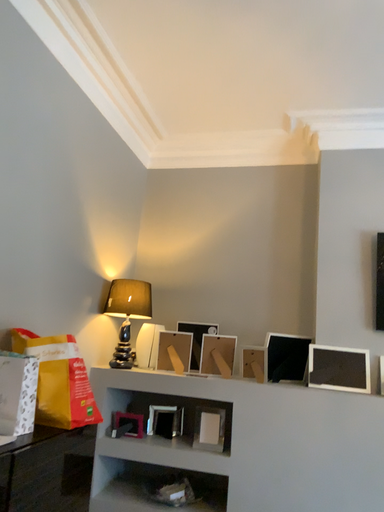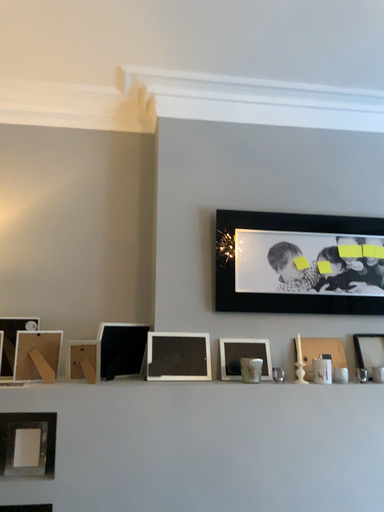
Question: How did the camera likely rotate when shooting the video?

Choices:
 (A) rotated left
 (B) rotated right

Answer: (B)